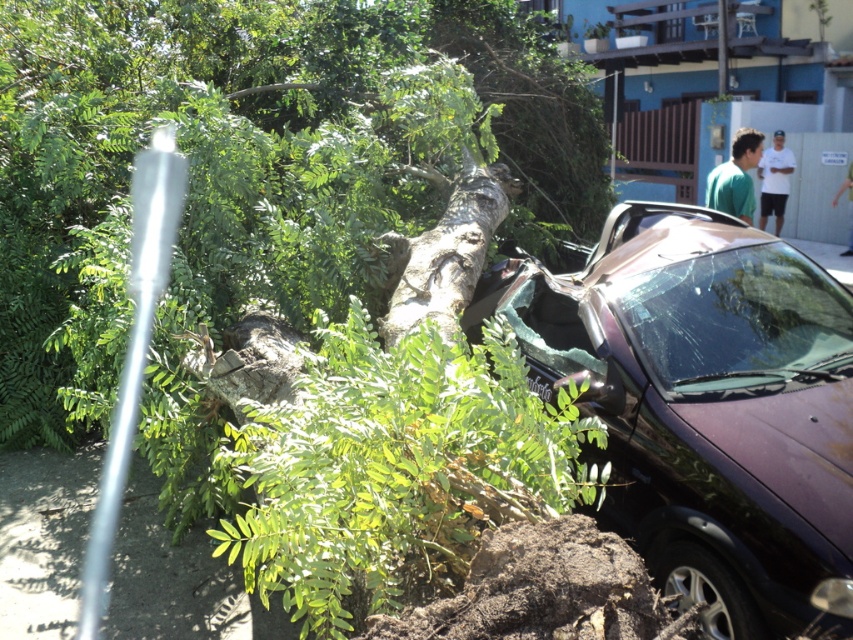
You are a city planner assessing potential risks in the area. The green leafy tree trunk at center is located at coordinates point 0.284, 0.295. Based on the scene, what potential risk does this tree pose to nearby structures?

The green leafy tree trunk at center, located at coordinates point (x=251, y=180), poses a risk of damaging nearby structures like the parked car due to its large size and potential for falling during storms or strong winds.

You are a delivery person trying to deliver a package to the house behind the fallen tree. You see the green matte shirt at upper right and the white cotton shirt at upper right hanging on a fence. Which shirt is closer to you as you approach the house?

The green matte shirt at upper right is in front of the white cotton shirt at upper right, so it is closer to you as you approach the house.